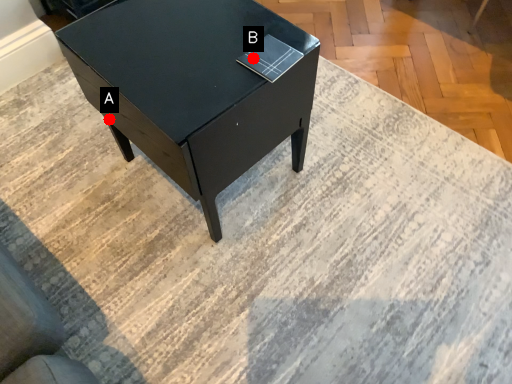
Question: Two points are circled on the image, labeled by A and B beside each circle. Among these points, which one is nearest to the camera?

Choices:
 (A) A is closer
 (B) B is closer

Answer: (B)